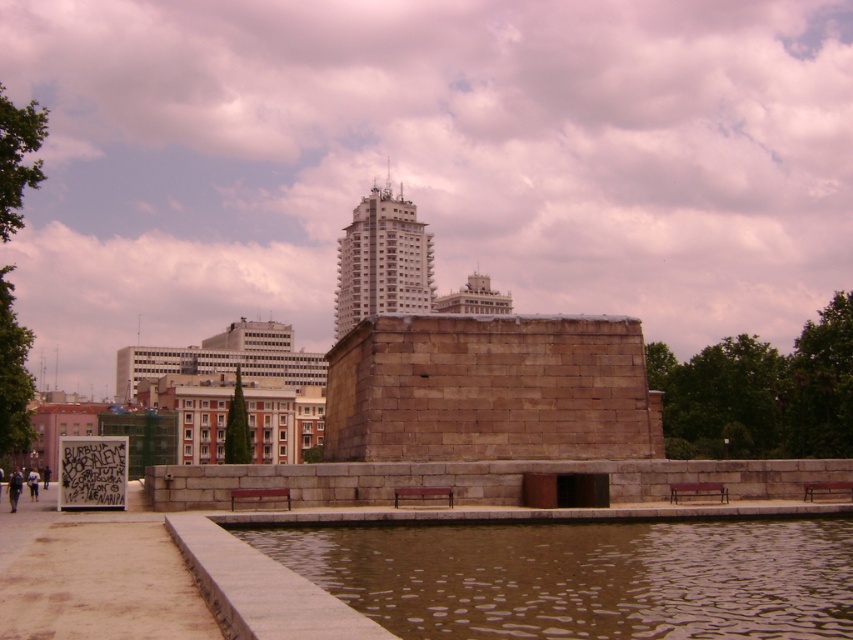
Does brown water at lower center have a smaller size compared to white concrete building at upper center?

Correct, brown water at lower center occupies less space than white concrete building at upper center.

Is brown water at lower center positioned before white concrete building at upper center?

Yes, brown water at lower center is closer to the viewer.

Is point (418, 547) farther from camera compared to point (346, 260)?

No.

I want to click on brown water at lower center, so click(x=582, y=577).

Measure the distance between point [415,280] and camera.

Point [415,280] and camera are 205.43 meters apart from each other.

Does white concrete building at upper center have a greater width compared to white stone building at center?

No.

Which is in front, point (381, 202) or point (241, 320)?

Point (241, 320) is in front.

Locate an element on the screen. The height and width of the screenshot is (640, 853). white concrete building at upper center is located at coordinates (381, 260).

Does brown water at lower center come in front of white stone building at center?

Yes.

Between brown water at lower center and white stone building at center, which one is positioned lower?

brown water at lower center is lower down.

Is point (363, 529) behind point (299, 352)?

No, (363, 529) is in front of (299, 352).

Identify the location of brown water at lower center. This screenshot has width=853, height=640. (582, 577).